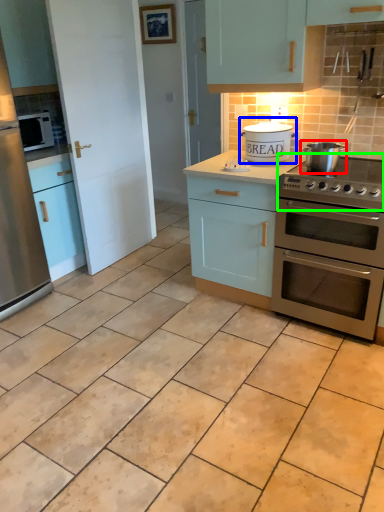
Question: Considering the real-world distances, which object is closest to appliance (highlighted by a red box)? appliance (highlighted by a blue box) or gas stove (highlighted by a green box).

Choices:
 (A) appliance
 (B) gas stove

Answer: (B)